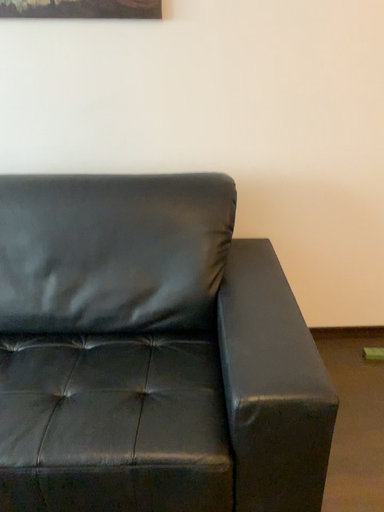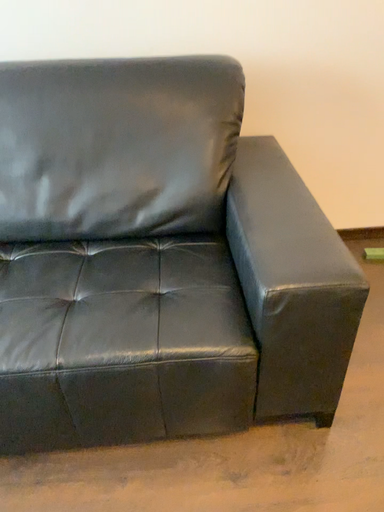
Question: How did the camera likely rotate when shooting the video?

Choices:
 (A) rotated upward
 (B) rotated downward

Answer: (B)